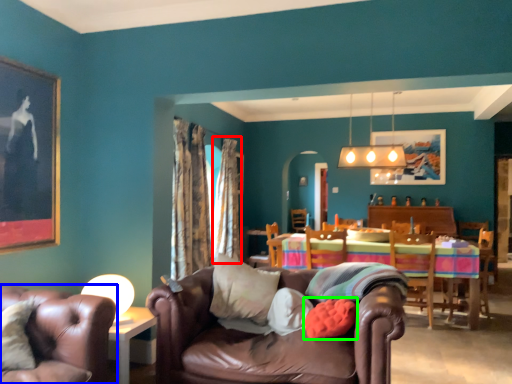
Question: Which object is positioned closest to curtain (highlighted by a red box)? Select from chair (highlighted by a blue box) and pillow (highlighted by a green box).

Choices:
 (A) chair
 (B) pillow

Answer: (B)